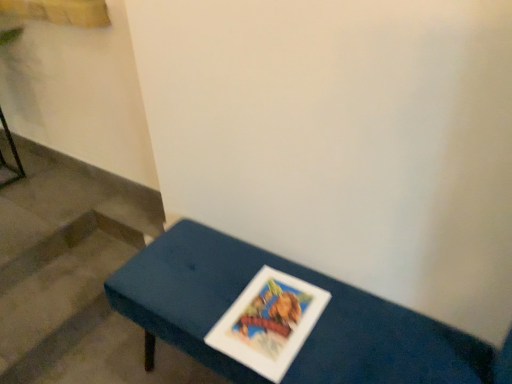
Question: Is blue fabric bench at center wider than metallic black stool at left?

Choices:
 (A) yes
 (B) no

Answer: (A)

Question: Does blue fabric bench at center have a smaller size compared to metallic black stool at left?

Choices:
 (A) no
 (B) yes

Answer: (A)

Question: Can you confirm if blue fabric bench at center is thinner than metallic black stool at left?

Choices:
 (A) yes
 (B) no

Answer: (B)

Question: Is blue fabric bench at center shorter than metallic black stool at left?

Choices:
 (A) yes
 (B) no

Answer: (B)

Question: Does blue fabric bench at center have a greater height compared to metallic black stool at left?

Choices:
 (A) yes
 (B) no

Answer: (A)

Question: Is point (x=64, y=337) closer or farther from the camera than point (x=23, y=172)?

Choices:
 (A) closer
 (B) farther

Answer: (A)

Question: From a real-world perspective, is wooden stairs at lower left positioned above or below metallic black stool at left?

Choices:
 (A) below
 (B) above

Answer: (A)

Question: Looking at the image, does wooden stairs at lower left seem bigger or smaller compared to metallic black stool at left?

Choices:
 (A) small
 (B) big

Answer: (B)

Question: Considering the positions of wooden stairs at lower left and metallic black stool at left in the image, is wooden stairs at lower left taller or shorter than metallic black stool at left?

Choices:
 (A) tall
 (B) short

Answer: (B)

Question: From the image's perspective, relative to blue fabric bench at center, is wooden stairs at lower left above or below?

Choices:
 (A) below
 (B) above

Answer: (B)

Question: Considering the positions of wooden stairs at lower left and blue fabric bench at center in the image, is wooden stairs at lower left wider or thinner than blue fabric bench at center?

Choices:
 (A) thin
 (B) wide

Answer: (B)

Question: Choose the correct answer: Is wooden stairs at lower left inside blue fabric bench at center or outside it?

Choices:
 (A) inside
 (B) outside

Answer: (B)

Question: In terms of height, does wooden stairs at lower left look taller or shorter compared to blue fabric bench at center?

Choices:
 (A) short
 (B) tall

Answer: (A)

Question: Looking at the image, does blue fabric bench at center seem bigger or smaller compared to wooden stairs at lower left?

Choices:
 (A) big
 (B) small

Answer: (A)

Question: In the image, is blue fabric bench at center on the left side or the right side of wooden stairs at lower left?

Choices:
 (A) left
 (B) right

Answer: (B)